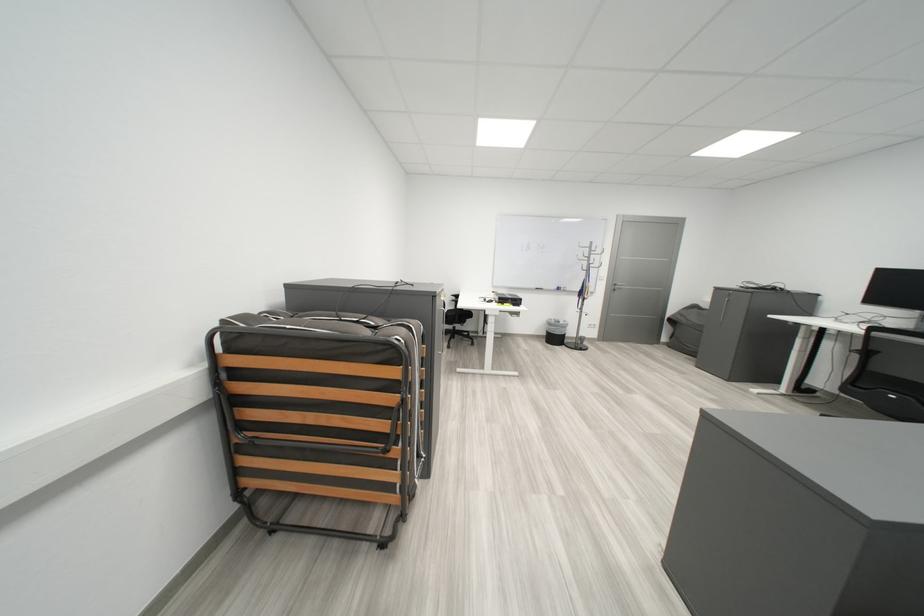
Where would you hang the metal coat rack hook? Please return your answer as a coordinate pair (x, y).

(585, 248)